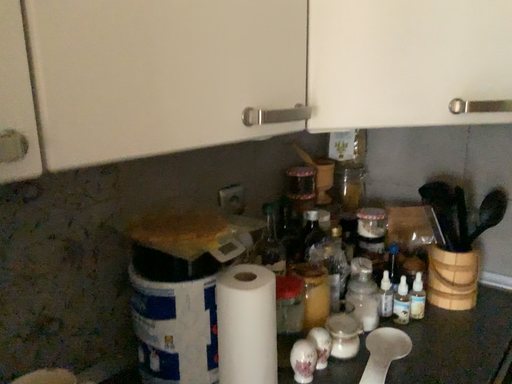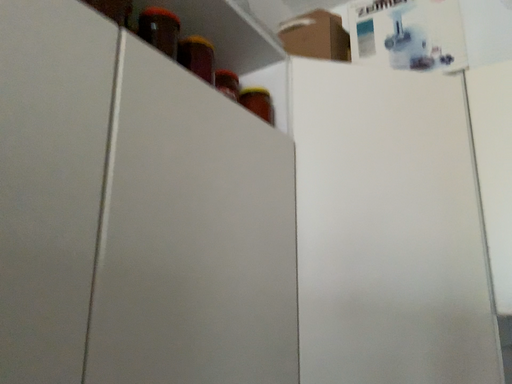
Question: How did the camera likely rotate when shooting the video?

Choices:
 (A) rotated right
 (B) rotated left

Answer: (A)